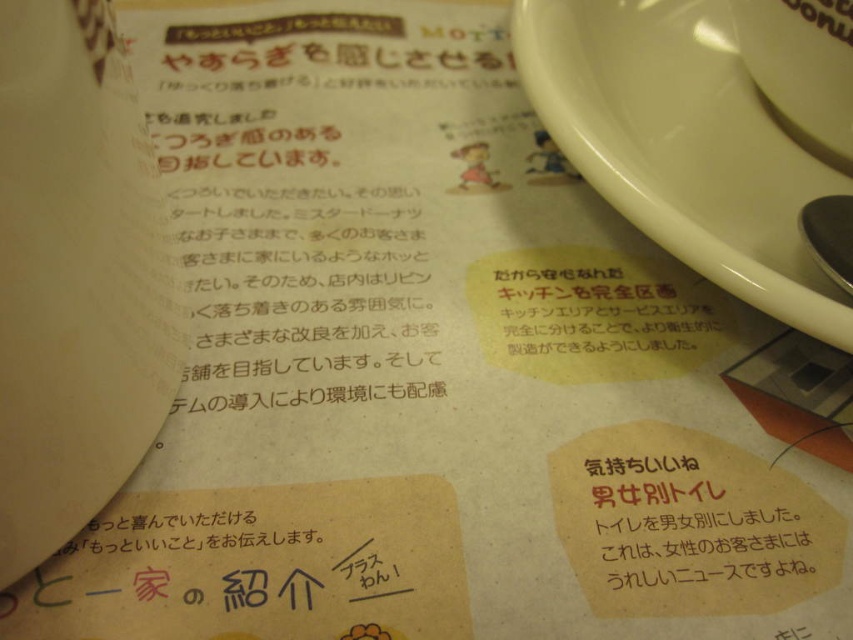
Question: Among these points, which one is farthest from the camera?

Choices:
 (A) (537, 1)
 (B) (776, 8)
 (C) (833, 209)

Answer: (A)

Question: Is white glossy saucer at upper right thinner than white glossy coffee cup at upper right?

Choices:
 (A) no
 (B) yes

Answer: (A)

Question: Does white glossy coffee cup at upper right appear over shiny metallic spoon at right?

Choices:
 (A) no
 (B) yes

Answer: (B)

Question: Which point is closer to the camera?

Choices:
 (A) white glossy saucer at upper right
 (B) shiny metallic spoon at right

Answer: (A)

Question: Which object is farther from the camera taking this photo?

Choices:
 (A) white glossy saucer at upper right
 (B) white glossy coffee cup at upper right

Answer: (B)

Question: Can you confirm if white glossy saucer at upper right is positioned to the right of white glossy coffee cup at upper right?

Choices:
 (A) yes
 (B) no

Answer: (B)